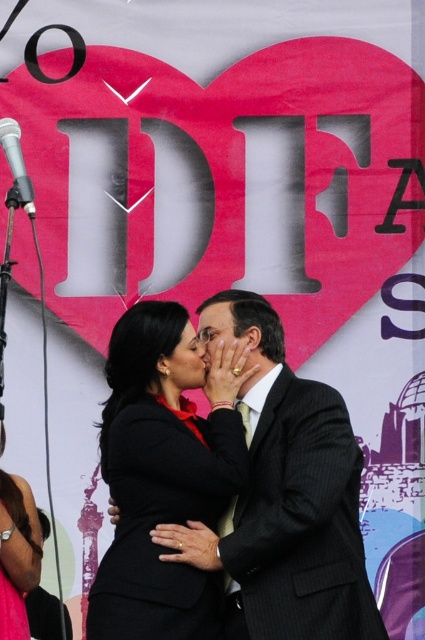
Question: Does black pinstripe suit at center appear on the right side of matte black suit at center?

Choices:
 (A) yes
 (B) no

Answer: (A)

Question: Estimate the real-world distances between objects in this image. Which object is farther from the black matte suit at center?

Choices:
 (A) matte black face at center
 (B) black plastic microphone at upper left
 (C) black pinstripe suit at center
 (D) smooth skin face at center

Answer: (B)

Question: Can you confirm if matte black face at center is positioned to the right of smooth skin face at center?

Choices:
 (A) yes
 (B) no

Answer: (B)

Question: Which object is the farthest from the matte black suit at center?

Choices:
 (A) black plastic microphone at upper left
 (B) smooth skin face at center
 (C) matte black face at center

Answer: (A)

Question: Is black matte suit at center positioned before matte black suit at center?

Choices:
 (A) yes
 (B) no

Answer: (A)

Question: Which point is farther to the camera?

Choices:
 (A) (249, 362)
 (B) (173, 428)

Answer: (A)